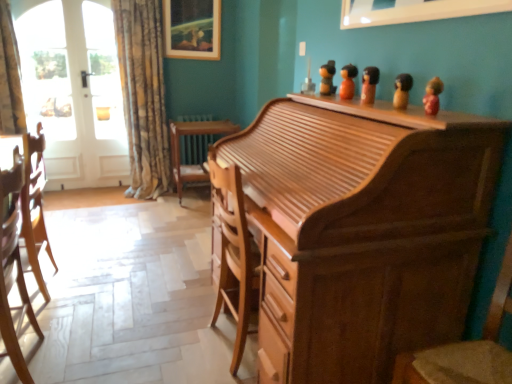
Question: Is wooden chair at center beside white glossy door at left?

Choices:
 (A) no
 (B) yes

Answer: (A)

Question: Considering the relative positions of wooden chair at center and white glossy door at left in the image provided, is wooden chair at center in front of white glossy door at left?

Choices:
 (A) no
 (B) yes

Answer: (B)

Question: Are wooden chair at center and white glossy door at left located far from each other?

Choices:
 (A) yes
 (B) no

Answer: (A)

Question: Does wooden chair at center have a lesser height compared to white glossy door at left?

Choices:
 (A) no
 (B) yes

Answer: (B)

Question: Could you tell me if wooden chair at center is turned towards white glossy door at left?

Choices:
 (A) yes
 (B) no

Answer: (B)

Question: Is wooden chair at center outside white glossy door at left?

Choices:
 (A) no
 (B) yes

Answer: (B)

Question: Are white glossy door at left and wooden picture frame at upper center, the 1th picture frame in the left-to-right sequence, located far from each other?

Choices:
 (A) yes
 (B) no

Answer: (B)

Question: Is white glossy door at left to the right of wooden picture frame at upper center, which is counted as the 2th picture frame, starting from the right, from the viewer's perspective?

Choices:
 (A) no
 (B) yes

Answer: (A)

Question: Is white glossy door at left positioned before wooden picture frame at upper center, which is counted as the 2th picture frame, starting from the right?

Choices:
 (A) no
 (B) yes

Answer: (B)

Question: Is white glossy door at left facing towards wooden picture frame at upper center, which is the 2th picture frame from front to back?

Choices:
 (A) yes
 (B) no

Answer: (B)

Question: Can you see white glossy door at left touching wooden picture frame at upper center, the 1th picture frame in the left-to-right sequence?

Choices:
 (A) no
 (B) yes

Answer: (A)

Question: Is wooden picture frame at upper center, the 1th picture frame in the left-to-right sequence, located within white glossy door at left?

Choices:
 (A) no
 (B) yes

Answer: (A)

Question: Does wooden picture frame at upper center, the second picture frame when ordered from bottom to top, have a greater height compared to light brown wood chair at left, the 1th chair from the left?

Choices:
 (A) no
 (B) yes

Answer: (A)